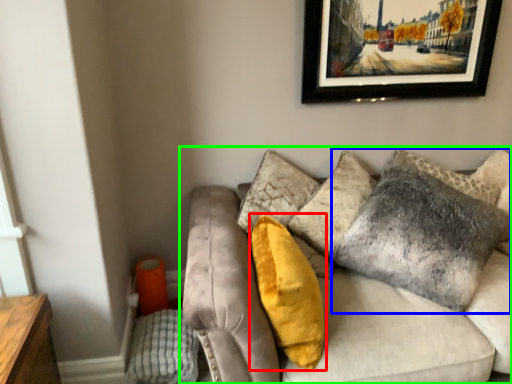
Question: Which object is the closest to the pillow (highlighted by a red box)? Choose among these: pillow (highlighted by a blue box) or studio couch (highlighted by a green box).

Choices:
 (A) pillow
 (B) studio couch

Answer: (B)